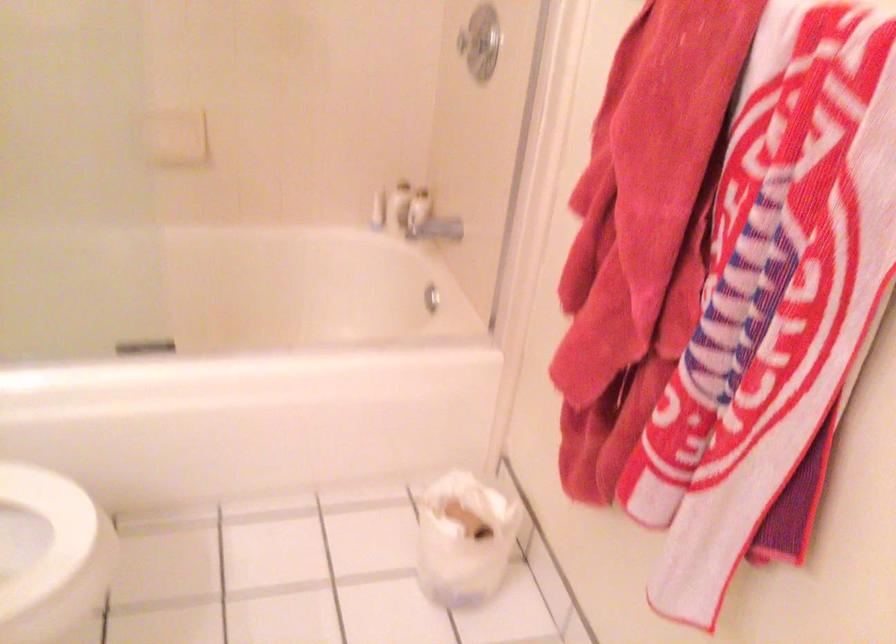
The height and width of the screenshot is (644, 896). I want to click on drain stopper lever, so click(x=431, y=298).